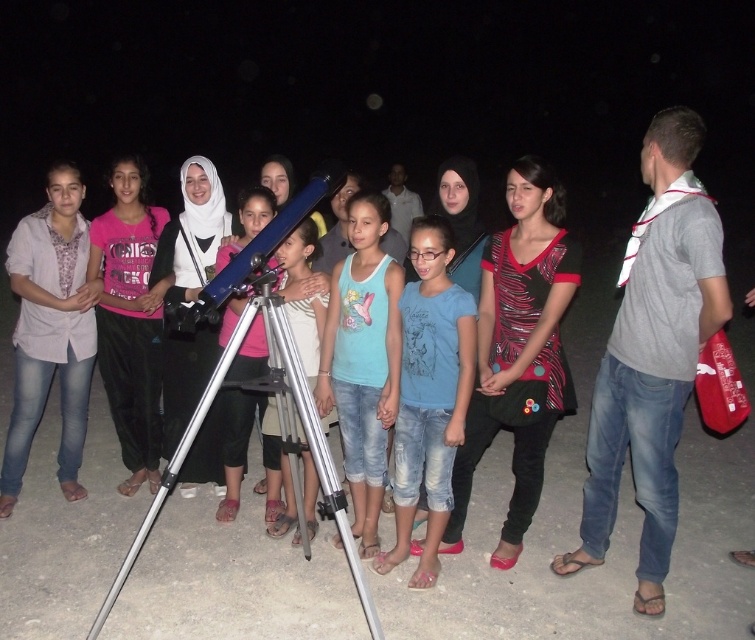
Question: Can you confirm if matte gray shirt at left is thinner than pink fabric shirt at center?

Choices:
 (A) yes
 (B) no

Answer: (B)

Question: Estimate the real-world distances between objects in this image. Which object is farther from the silver metallic tripod at center?

Choices:
 (A) pink fabric shirt at center
 (B) blue denim jeans at center
 (C) matte gray shirt at left

Answer: (C)

Question: Which object is farther from the camera taking this photo?

Choices:
 (A) silver metallic tripod at center
 (B) metallic silver telescope at center
 (C) light blue denim shorts at center
 (D) matte gray shirt at left

Answer: (D)

Question: Does blue denim jeans at center have a lesser width compared to light blue denim shorts at center?

Choices:
 (A) yes
 (B) no

Answer: (B)

Question: Which point is closer to the camera?

Choices:
 (A) (399, 385)
 (B) (153, 362)
 (C) (359, 339)
 (D) (196, 428)

Answer: (D)

Question: Does matte gray shirt at left have a greater width compared to light blue denim shorts at center?

Choices:
 (A) yes
 (B) no

Answer: (A)